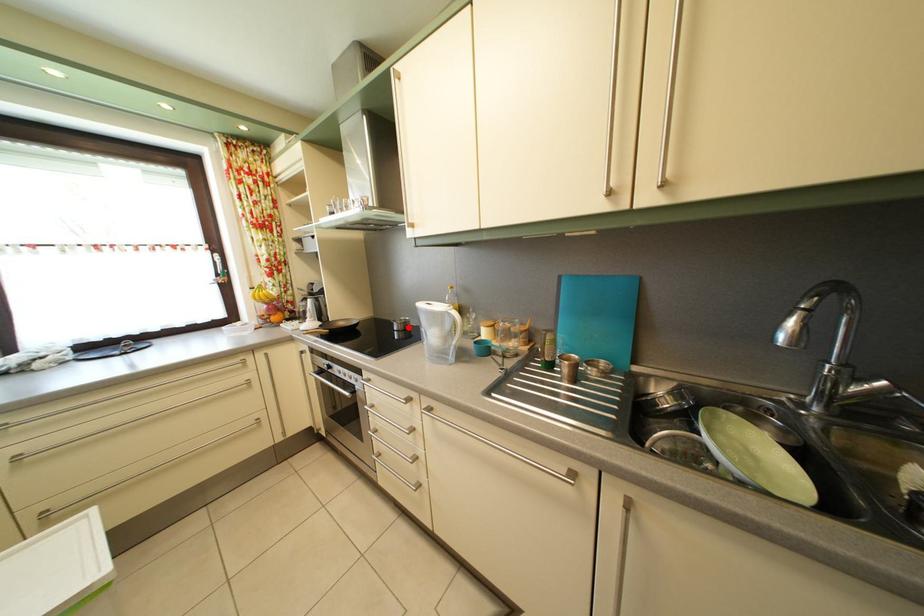
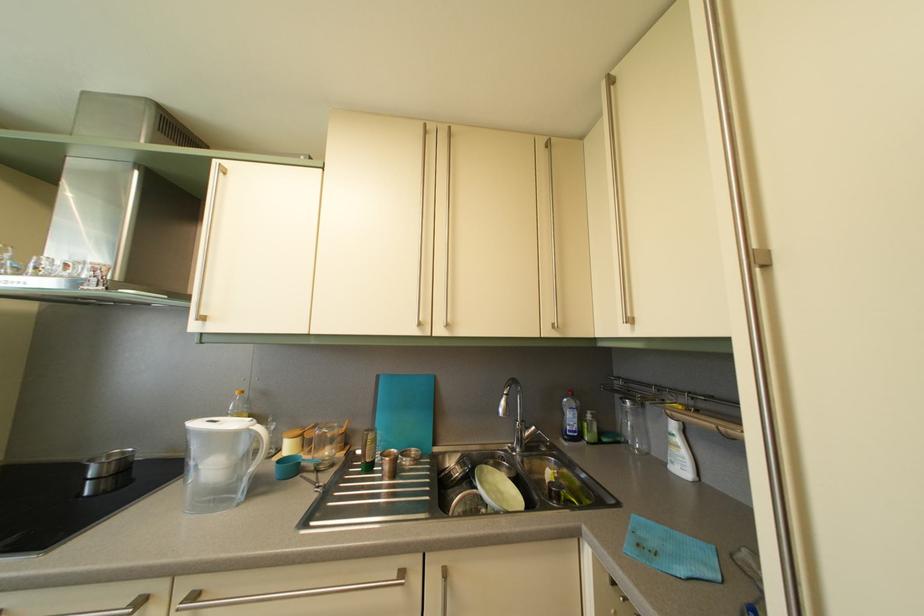
Question: A red point is marked in image1. In image2, is the corresponding 3D point closer to the camera or farther? Reply with the corresponding letter.

Choices:
 (A) The corresponding 3D point is closer.
 (B) The corresponding 3D point is farther.

Answer: (A)